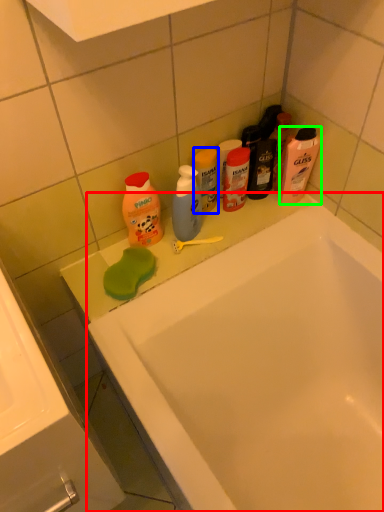
Question: Which is nearer to the bathtub (highlighted by a red box)? cleaning product (highlighted by a blue box) or cleaning product (highlighted by a green box).

Choices:
 (A) cleaning product
 (B) cleaning product

Answer: (B)